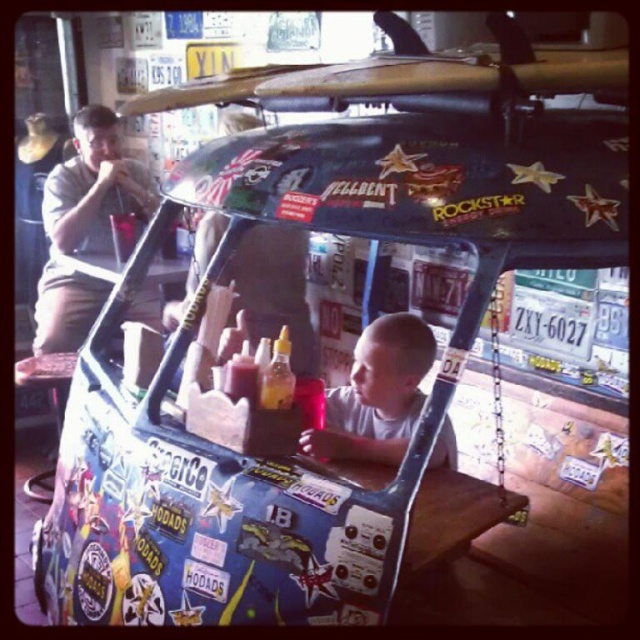
You are a customer at the food cart and want to place your matte khaki shorts at left on the stickered plastic surfboard at center. Will the shorts fit entirely on the surfboard?

The stickered plastic surfboard at center is wider than the matte khaki shorts at left, so the shorts will fit entirely on the surfboard.

You are a parent who wants to ensure your child is safe from the sun while waiting at the food cart. The smooth skin child at center is under the umbrella, and the matte khaki shorts at left are part of the parent. Can you confirm if the child is protected from the sun based on their position relative to the umbrella?

The matte khaki shorts at left is above the smooth skin child at center, which means the parent is standing over the child. Since the umbrella is partially open and the child is under it, the child is likely protected from the sun.